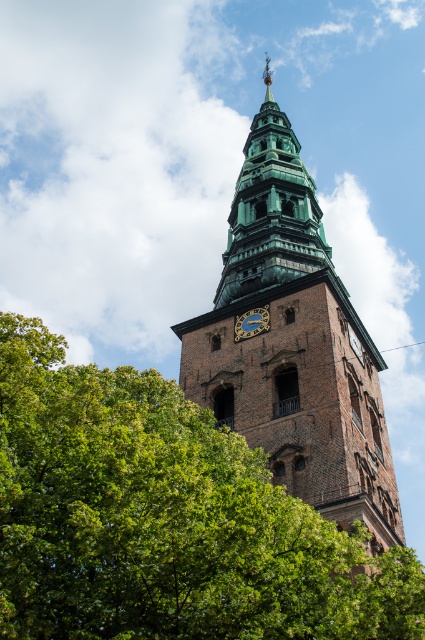
Question: Can you confirm if green patina bell tower at upper center is thinner than green metallic clock at center?

Choices:
 (A) yes
 (B) no

Answer: (B)

Question: Based on their relative distances, which object is nearer to the green patina bell tower at upper center?

Choices:
 (A) brown brick church tower at center
 (B) green leafy tree at lower left
 (C) green metallic clock at center

Answer: (A)

Question: Can you confirm if green patina bell tower at upper center is positioned above green metallic clock at center?

Choices:
 (A) no
 (B) yes

Answer: (B)

Question: Among these objects, which one is nearest to the camera?

Choices:
 (A) green metallic clock at center
 (B) brown brick church tower at center

Answer: (B)

Question: Which object is the farthest from the green metallic clock at center?

Choices:
 (A) green leafy tree at lower left
 (B) brown brick church tower at center

Answer: (A)

Question: Is brown brick church tower at center smaller than green metallic clock at center?

Choices:
 (A) yes
 (B) no

Answer: (B)